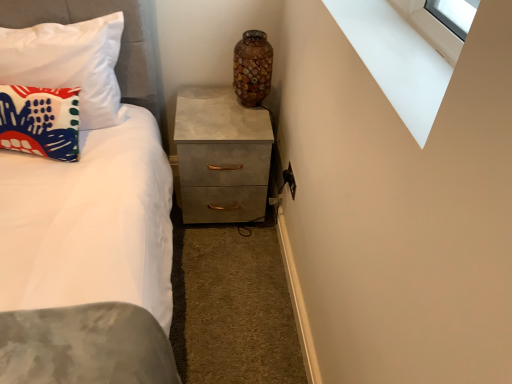
Question: Is mosaic glass vase at upper center far away from white smooth window sill at upper right?

Choices:
 (A) yes
 (B) no

Answer: (B)

Question: From a real-world perspective, is mosaic glass vase at upper center beneath white smooth window sill at upper right?

Choices:
 (A) no
 (B) yes

Answer: (B)

Question: Can we say mosaic glass vase at upper center lies outside white smooth window sill at upper right?

Choices:
 (A) yes
 (B) no

Answer: (A)

Question: Can you confirm if mosaic glass vase at upper center is thinner than white smooth window sill at upper right?

Choices:
 (A) no
 (B) yes

Answer: (B)

Question: From the image's perspective, is mosaic glass vase at upper center on top of white smooth window sill at upper right?

Choices:
 (A) yes
 (B) no

Answer: (A)

Question: Do you think matte concrete chest of drawers at center is within matte fabric pillow at left, which is counted as the 2th pillow, starting from the top, or outside of it?

Choices:
 (A) outside
 (B) inside

Answer: (A)

Question: Based on their positions, is matte concrete chest of drawers at center located to the left or right of matte fabric pillow at left, which ranks as the 1th pillow in bottom-to-top order?

Choices:
 (A) right
 (B) left

Answer: (A)

Question: Considering the positions of matte concrete chest of drawers at center and matte fabric pillow at left, which ranks as the 1th pillow in bottom-to-top order, in the image, is matte concrete chest of drawers at center taller or shorter than matte fabric pillow at left, which ranks as the 1th pillow in bottom-to-top order,?

Choices:
 (A) tall
 (B) short

Answer: (A)

Question: From a real-world perspective, is matte concrete chest of drawers at center physically located above or below matte fabric pillow at left, which ranks as the 1th pillow in bottom-to-top order?

Choices:
 (A) below
 (B) above

Answer: (A)

Question: Do you think matte fabric pillow at left, acting as the 2th pillow starting from the bottom, is within white smooth window sill at upper right, or outside of it?

Choices:
 (A) outside
 (B) inside

Answer: (A)

Question: From the image's perspective, relative to white smooth window sill at upper right, is matte fabric pillow at left, acting as the first pillow starting from the top, above or below?

Choices:
 (A) below
 (B) above

Answer: (B)

Question: Based on their sizes in the image, would you say matte fabric pillow at left, acting as the 2th pillow starting from the bottom, is bigger or smaller than white smooth window sill at upper right?

Choices:
 (A) big
 (B) small

Answer: (A)

Question: From a real-world perspective, is matte fabric pillow at left, acting as the 2th pillow starting from the bottom, above or below white smooth window sill at upper right?

Choices:
 (A) above
 (B) below

Answer: (B)

Question: Considering the positions of matte fabric pillow at left, acting as the 2th pillow starting from the bottom, and matte concrete chest of drawers at center in the image, is matte fabric pillow at left, acting as the 2th pillow starting from the bottom, taller or shorter than matte concrete chest of drawers at center?

Choices:
 (A) short
 (B) tall

Answer: (B)

Question: Considering the positions of matte fabric pillow at left, acting as the 2th pillow starting from the bottom, and matte concrete chest of drawers at center in the image, is matte fabric pillow at left, acting as the 2th pillow starting from the bottom, bigger or smaller than matte concrete chest of drawers at center?

Choices:
 (A) small
 (B) big

Answer: (A)